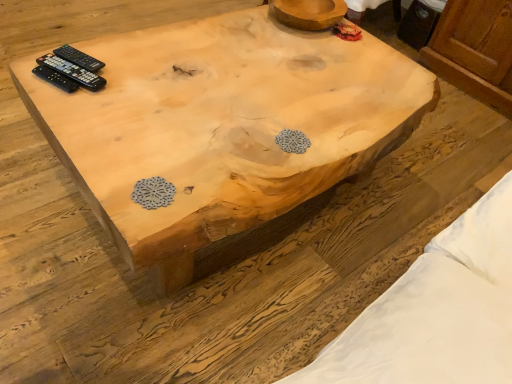
The image size is (512, 384). In order to click on vacant space behind black plastic remote controls at upper left, the second remote control from the back in this screenshot , I will do [x=111, y=45].